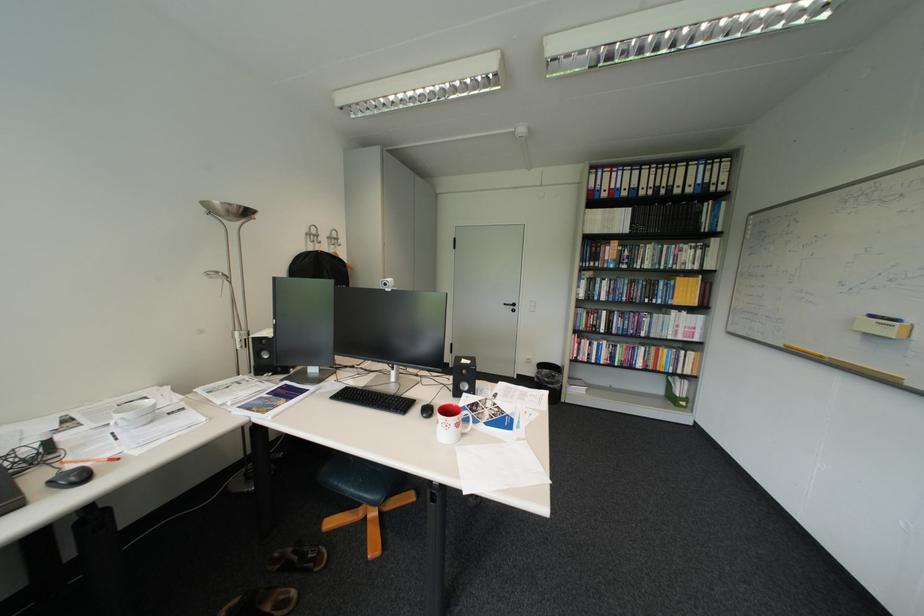
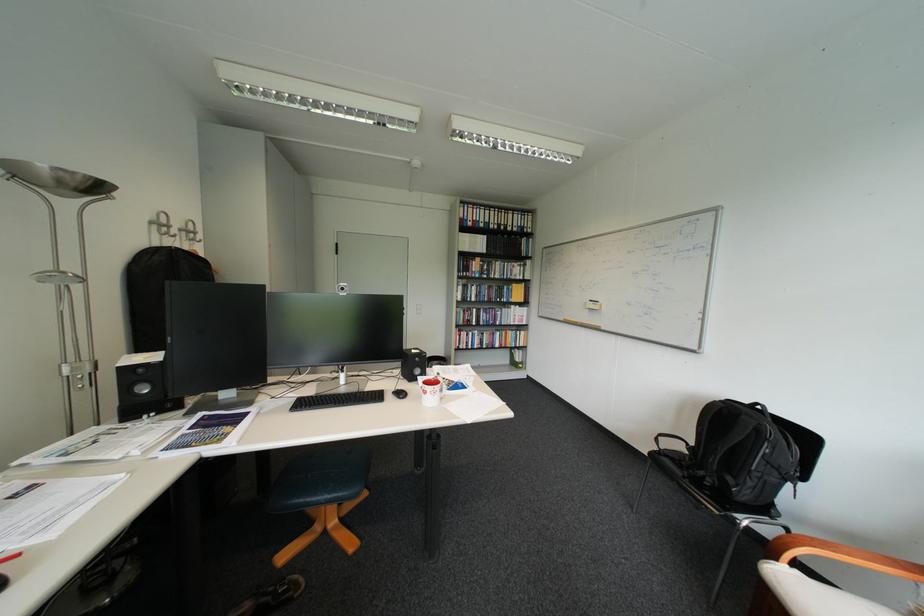
The point at (650, 302) is marked in the first image. Where is the corresponding point in the second image?

(505, 301)